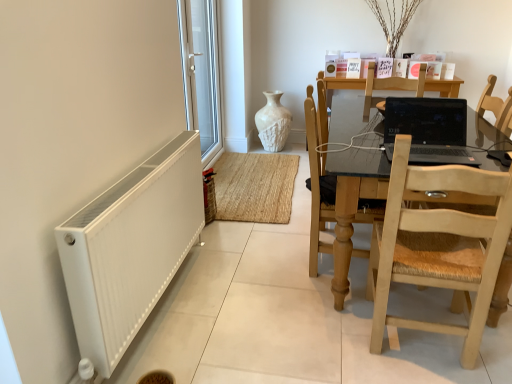
Where is `vacant region below light wood/rattan chair at right, positioned as the 2th chair in back-to-front order (from a real-world perspective)`? This screenshot has width=512, height=384. vacant region below light wood/rattan chair at right, positioned as the 2th chair in back-to-front order (from a real-world perspective) is located at coordinates (422, 347).